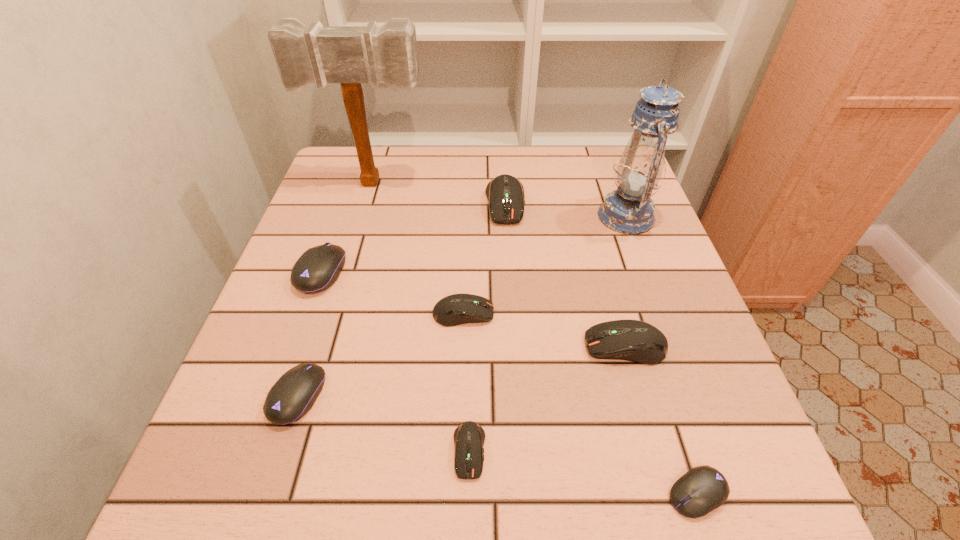
Where is `mallet`? mallet is located at coordinates (350, 55).

I want to click on the second tallest object, so click(629, 210).

Where is `the tallest computer mouse`? The width and height of the screenshot is (960, 540). the tallest computer mouse is located at coordinates (505, 193).

Image resolution: width=960 pixels, height=540 pixels. What are the coordinates of `the farthest dark computer equipment` in the screenshot? It's located at (505, 193).

Identify the location of the second nearest dark computer equipment. This screenshot has width=960, height=540. (631, 340).

At what (x,y) coordinates should I click in order to perform the action: click on the rightmost dark computer equipment. Please return your answer as a coordinate pair (x, y). Looking at the image, I should click on (631, 340).

You are a GUI agent. You are given a task and a screenshot of the screen. Output one action in this format:
    pyautogui.click(x=<x>, y=<y>)
    Task: Click on the biggest black computer mouse
    
    Given the screenshot: What is the action you would take?
    pyautogui.click(x=318, y=268)

Where is `the fourth farthest object`? The image size is (960, 540). the fourth farthest object is located at coordinates (318, 268).

This screenshot has width=960, height=540. I want to click on the fifth nearest object, so (x=456, y=309).

The image size is (960, 540). In order to click on the third biggest dark computer equipment in this screenshot , I will do `click(456, 309)`.